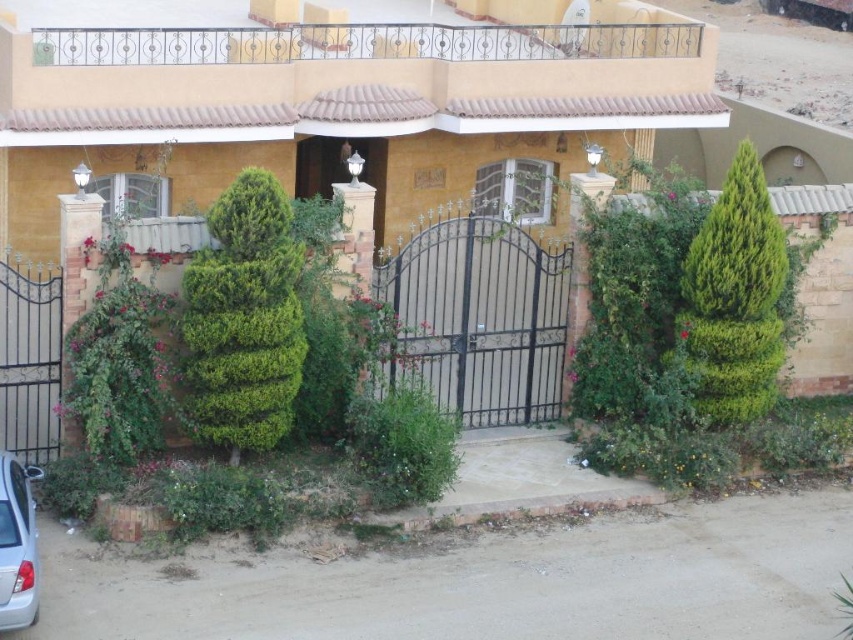
Question: Considering the relative positions of green textured bush at right and white glossy car at lower left in the image provided, where is green textured bush at right located with respect to white glossy car at lower left?

Choices:
 (A) left
 (B) right

Answer: (B)

Question: Which object is farther from the camera taking this photo?

Choices:
 (A) green leafy hedge at center
 (B) green textured bush at right

Answer: (B)

Question: Can you confirm if green leafy hedge at center is positioned to the right of white glossy car at lower left?

Choices:
 (A) no
 (B) yes

Answer: (B)

Question: Based on their relative distances, which object is farther from the green leafy hedge at center?

Choices:
 (A) green textured bush at right
 (B) white glossy car at lower left

Answer: (A)

Question: Can you confirm if green leafy hedge at center is positioned to the left of white glossy car at lower left?

Choices:
 (A) yes
 (B) no

Answer: (B)

Question: Which of the following is the farthest from the observer?

Choices:
 (A) green leafy hedge at center
 (B) green textured bush at right
 (C) white glossy car at lower left

Answer: (B)